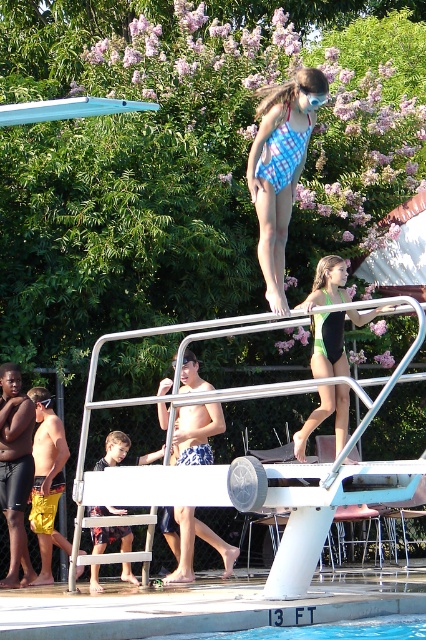
Can you confirm if blue plaid swimsuit at center is positioned below blue smooth water at lower center?

No, blue plaid swimsuit at center is not below blue smooth water at lower center.

The image size is (426, 640). Describe the element at coordinates (281, 168) in the screenshot. I see `blue plaid swimsuit at center` at that location.

Find the location of a particular element. This screenshot has width=426, height=640. blue plaid swimsuit at center is located at coordinates (281, 168).

Which is below, blue smooth water at lower center or dark blue shorts at center?

blue smooth water at lower center is lower down.

Who is taller, blue smooth water at lower center or dark blue shorts at center?

dark blue shorts at center is taller.

Locate an element on the screen. This screenshot has height=640, width=426. blue smooth water at lower center is located at coordinates pos(325,630).

Can you confirm if white metal rail at center is taller than green matte swimsuit at upper center?

In fact, white metal rail at center may be shorter than green matte swimsuit at upper center.

Who is higher up, white metal rail at center or green matte swimsuit at upper center?

green matte swimsuit at upper center

Is point (120, 500) positioned after point (340, 438)?

That is False.

Find the location of a particular element. The image size is (426, 640). white metal rail at center is located at coordinates (163, 465).